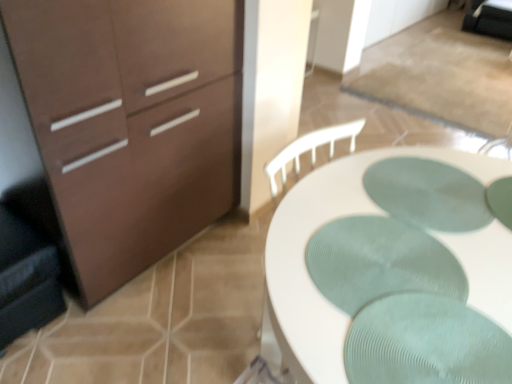
Locate an element on the screen. Image resolution: width=512 pixels, height=384 pixels. free point above green ribbed placemat at center, which is the 2th oval in back-to-front order (from a real-world perspective) is located at coordinates (x=381, y=265).